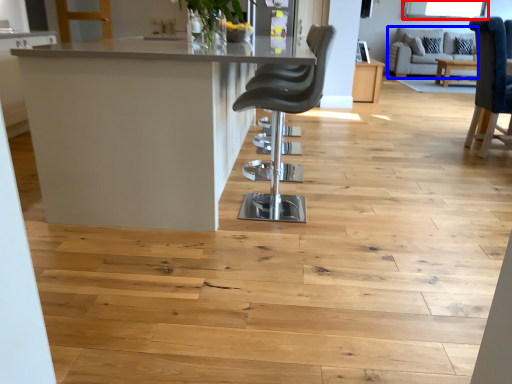
Question: Which object appears farthest to the camera in this image, window screen (highlighted by a red box) or couch (highlighted by a blue box)?

Choices:
 (A) window screen
 (B) couch

Answer: (A)